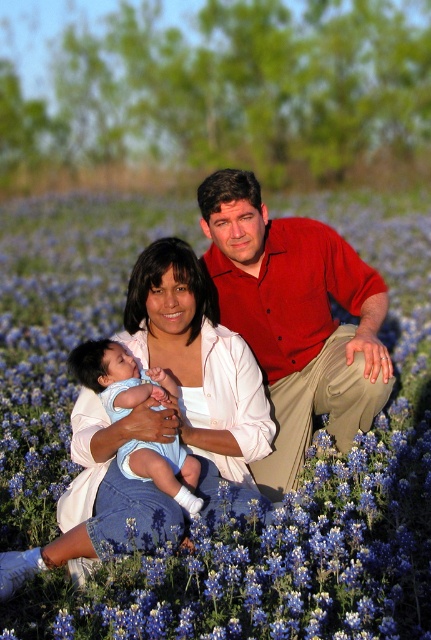
Where is `blue soft petals at center`? The height and width of the screenshot is (640, 431). blue soft petals at center is located at coordinates (294, 506).

Does point (83, 259) come closer to viewer compared to point (122, 356)?

That is False.

This screenshot has height=640, width=431. In order to click on blue soft petals at center in this screenshot , I will do `click(294, 506)`.

Can you confirm if matte red shirt at center is wider than light blue denim baby at center?

Yes.

Can you confirm if matte red shirt at center is positioned to the left of light blue denim baby at center?

No, matte red shirt at center is not to the left of light blue denim baby at center.

Is point (302, 387) positioned before point (131, 387)?

No, it is behind (131, 387).

Locate an element on the screen. matte red shirt at center is located at coordinates (296, 317).

Can you confirm if blue soft petals at center is wider than matte red shirt at center?

Correct, the width of blue soft petals at center exceeds that of matte red shirt at center.

Describe the element at coordinates (294, 506) in the screenshot. The height and width of the screenshot is (640, 431). I see `blue soft petals at center` at that location.

This screenshot has width=431, height=640. Identify the location of blue soft petals at center. (294, 506).